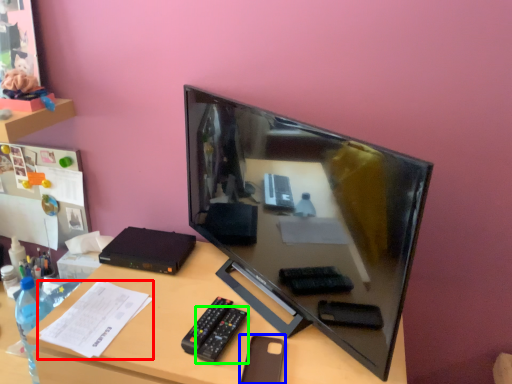
Question: Estimate the real-world distances between objects in this image. Which object is farther from paper (highlighted by a red box), stationery (highlighted by a blue box) or remote (highlighted by a green box)?

Choices:
 (A) stationery
 (B) remote

Answer: (A)